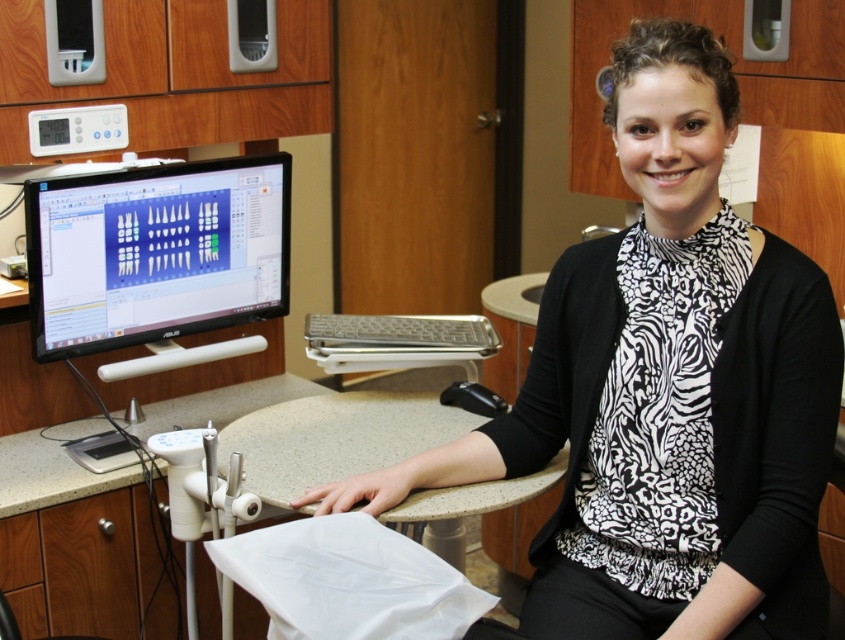
Is point (52, 189) closer to camera compared to point (108, 488)?

Yes.

Is matte black monitor at center further to camera compared to white laminate counter at lower center?

Yes, matte black monitor at center is behind white laminate counter at lower center.

Does point (172, 307) lie behind point (118, 477)?

Yes, it is behind point (118, 477).

Find the location of `matte black monitor at center`. matte black monitor at center is located at coordinates (155, 252).

Does black printed blouse at center appear over white laminate counter at lower center?

Correct, black printed blouse at center is located above white laminate counter at lower center.

Does point (456, 477) come behind point (90, 481)?

No, it is in front of (90, 481).

What do you see at coordinates (664, 392) in the screenshot? This screenshot has width=845, height=640. I see `black printed blouse at center` at bounding box center [664, 392].

You are a GUI agent. You are given a task and a screenshot of the screen. Output one action in this format:
    pyautogui.click(x=<x>, y=<y>)
    Task: Click on the black printed blouse at center
    Image resolution: width=845 pixels, height=640 pixels.
    Given the screenshot: What is the action you would take?
    pyautogui.click(x=664, y=392)

In order to click on black printed blouse at center in this screenshot , I will do `click(664, 392)`.

Looking at this image, does black printed blouse at center lie behind matte black monitor at center?

No, it is not.

Who is more distant from viewer, (671, 452) or (186, 310)?

Positioned behind is point (186, 310).

I want to click on black printed blouse at center, so click(664, 392).